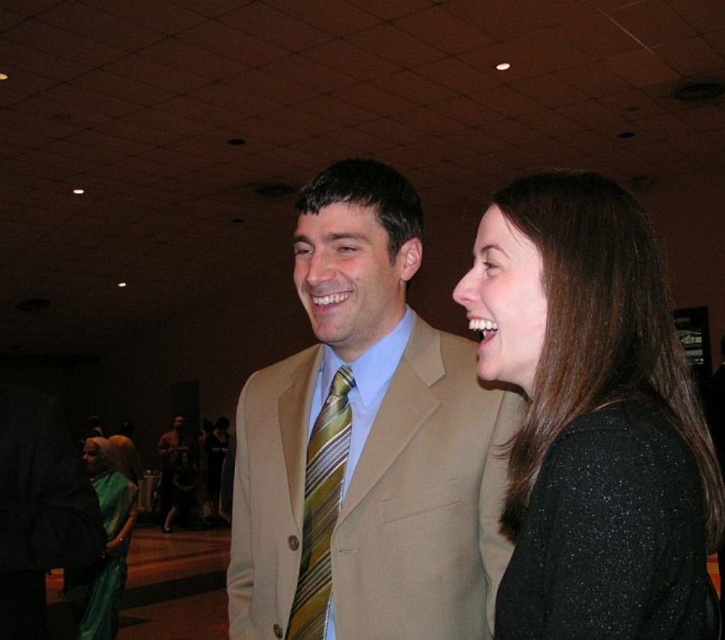
Question: Is black sparkly dress at right positioned before green silk saree at lower left?

Choices:
 (A) yes
 (B) no

Answer: (A)

Question: Is yellow striped tie at center wider than brown leather jacket at lower left?

Choices:
 (A) yes
 (B) no

Answer: (B)

Question: Which object is farther from the camera taking this photo?

Choices:
 (A) brown leather jacket at lower left
 (B) tan fabric suit at center
 (C) black sparkly sweater at right

Answer: (A)

Question: Which of the following is the farthest from the observer?

Choices:
 (A) brown leather jacket at lower left
 (B) yellow striped tie at center
 (C) black sparkly dress at right
 (D) green silk saree at lower left

Answer: (A)

Question: Can you confirm if tan fabric suit at center is bigger than green silk saree at lower left?

Choices:
 (A) yes
 (B) no

Answer: (B)

Question: Based on their relative distances, which object is farther from the black sparkly dress at right?

Choices:
 (A) black sparkly sweater at right
 (B) tan fabric suit at center
 (C) brown leather jacket at lower left
 (D) green silk saree at lower left

Answer: (C)